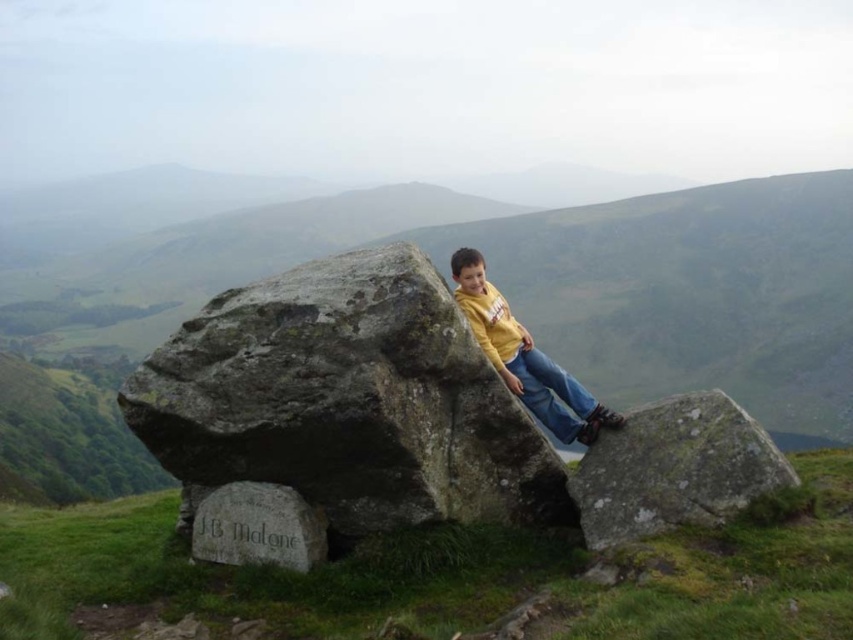
You are a hiker who wants to sit on the largest rock available in the scene. Which rock should you choose between the green mossy rock at center and the gray stone at lower center?

The green mossy rock at center is taller than the gray stone at lower center, so you should choose the green mossy rock at center as it is the larger one.

You are a photographer trying to capture the boy in the yellow matte shirt at center. You want to ensure the green mossy rock at center doesn

The green mossy rock at center is wider than the yellow matte shirt at center, so positioning the rock to frame the shirt would work well since it is wider and can provide a stable background.

You are a hiker who wants to place a 30 meter long tent between the green mossy rock at center and the gray stone at lower center. Is there enough space?

The distance between the green mossy rock at center and the gray stone at lower center is 27.16 meters. Since the tent is 30 meters long, it is longer than the available space. Therefore, the tent cannot be placed between them.